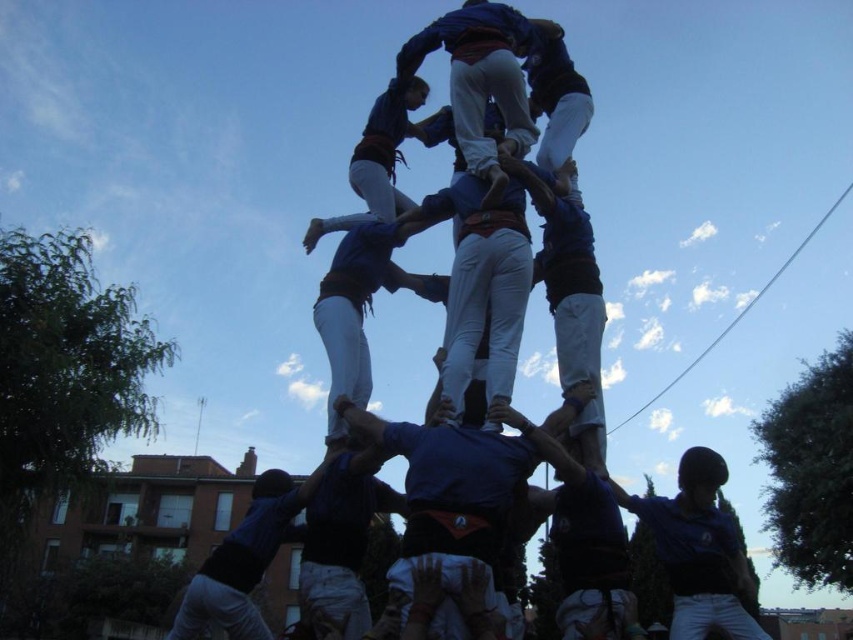
You are a photographer at the event and want to capture a photo of the blue fabric human at center and the blue fabric helmet at center. Which object should you focus on first if you want to highlight the taller one?

The blue fabric human at center is taller than the blue fabric helmet at center, so you should focus on the blue fabric human at center first to highlight its height.

You are a photographer standing at the base of the human tower. You want to take a photo of the point at coordinates point (508, 312) and point (242, 596). Which point will appear closer to the front of the photo?

Point (242, 596) will appear closer to the front of the photo because it is in front of point (508, 312).